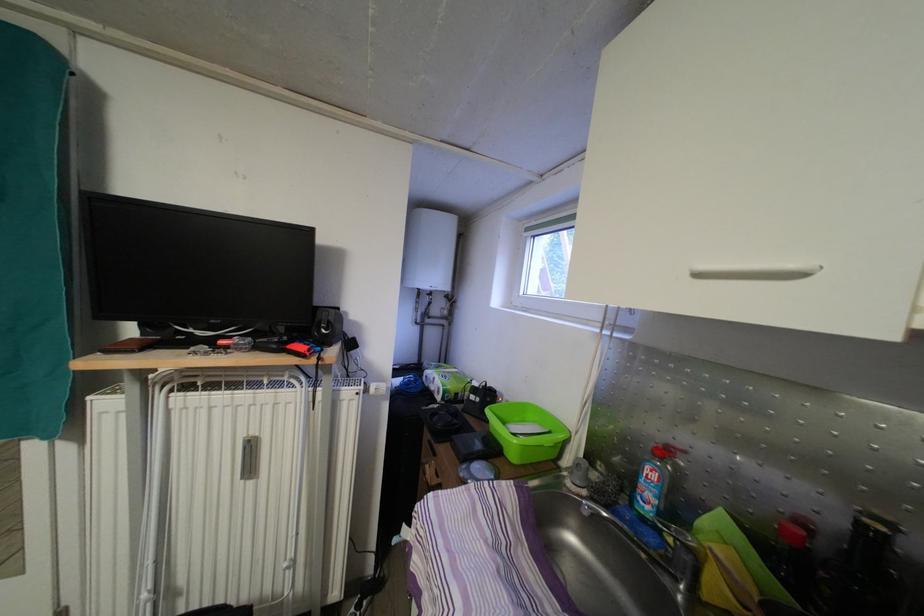
Where is `white radiator knob`? This screenshot has width=924, height=616. white radiator knob is located at coordinates (375, 387).